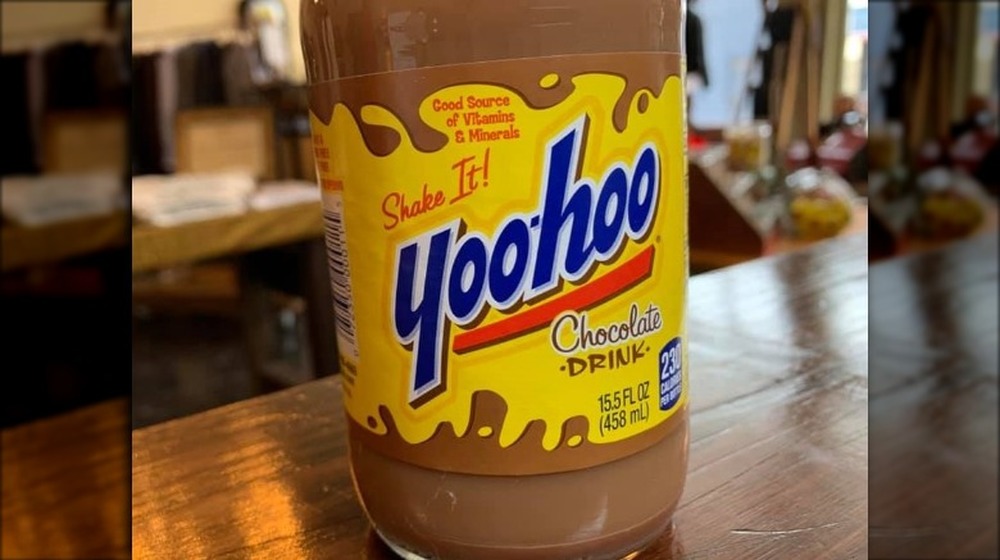
At what (x,y) coordinates should I click in order to perform the action: click on papers. Please return your answer as a coordinate pair (x, y). Looking at the image, I should click on (164, 188), (217, 200), (284, 183).